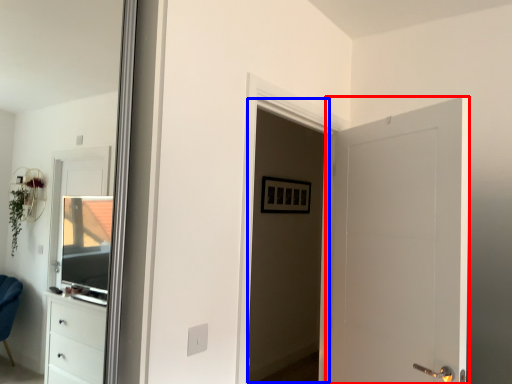
Question: Which object appears farthest to the camera in this image, door (highlighted by a red box) or screen door (highlighted by a blue box)?

Choices:
 (A) door
 (B) screen door

Answer: (B)